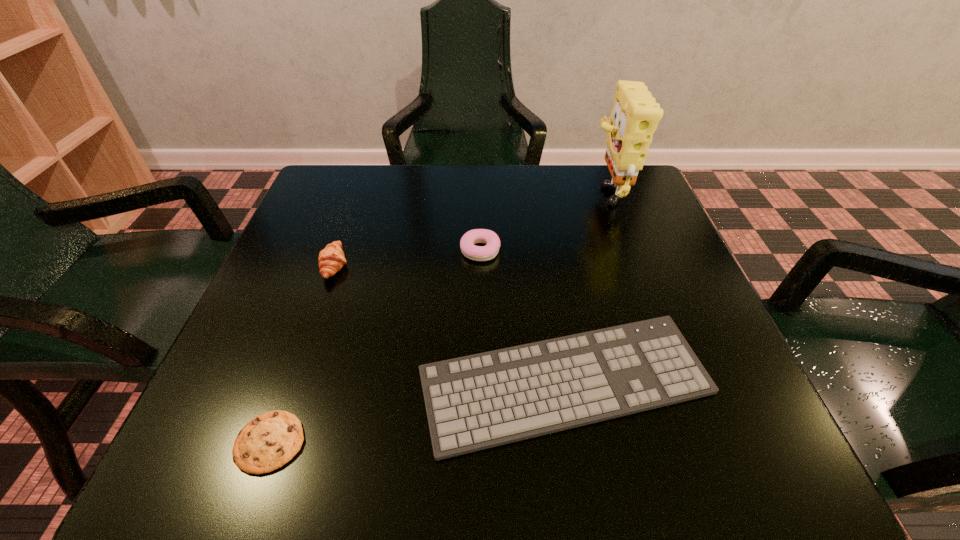
This screenshot has height=540, width=960. I want to click on vacant space situated on the face of the farthest object, so click(488, 191).

In order to click on free spot located 0.190m on the front-facing side of the second tallest object in this screenshot , I will do `click(443, 266)`.

Identify the location of free location located 0.110m on the front of the third tallest object. (480, 305).

Identify the location of vacant space situated on the back of the computer keyboard. (539, 215).

You are a GUI agent. You are given a task and a screenshot of the screen. Output one action in this format:
    pyautogui.click(x=<x>, y=<y>)
    Task: Click on the free space located on the right of the cookie
    The height and width of the screenshot is (540, 960).
    Given the screenshot: What is the action you would take?
    pyautogui.click(x=446, y=442)

Image resolution: width=960 pixels, height=540 pixels. I want to click on object situated at the far edge, so click(x=635, y=115).

The image size is (960, 540). What are the coordinates of `computer keyboard situated at the near edge` in the screenshot? It's located at (480, 401).

This screenshot has height=540, width=960. I want to click on cookie that is at the near edge, so click(267, 442).

Image resolution: width=960 pixels, height=540 pixels. Identify the location of pastry that is at the left edge. (331, 259).

Locate an element on the screen. This screenshot has width=960, height=540. cookie that is at the left edge is located at coordinates (267, 442).